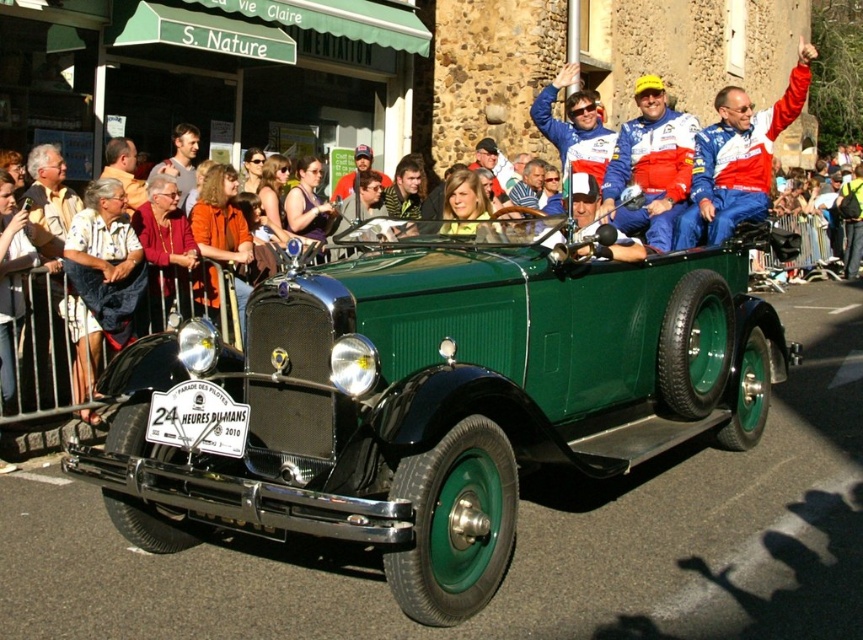
You are a photographer trying to capture the green matte vintage car at center and the matte orange shirt at upper center in the same frame. Which object should you focus on first to ensure both are in focus?

Since the green matte vintage car at center is closer to the viewer than the matte orange shirt at upper center, you should focus on the green matte vintage car at center first to ensure both are in focus.

You are a photographer at the event and want to capture both the matte orange shirt at upper center and the matte orange shirt at left in a single frame. Which shirt should you focus on to ensure both are clearly visible in the photo?

The matte orange shirt at upper center is smaller than the matte orange shirt at left. To ensure both are clearly visible, focus on the larger matte orange shirt at left, as it will remain detailed even when the smaller one is in the frame.

You are a photographer trying to capture the green matte vintage car at center and the matte orange shirt at upper center in the same frame. Based on their positions and sizes, which object would likely require you to adjust your camera angle more to ensure both are fully visible?

The green matte vintage car at center might require adjusting the camera angle more because it might be wider than the matte orange shirt at upper center, so to include both in the frame, you might need to widen your angle or move back slightly.